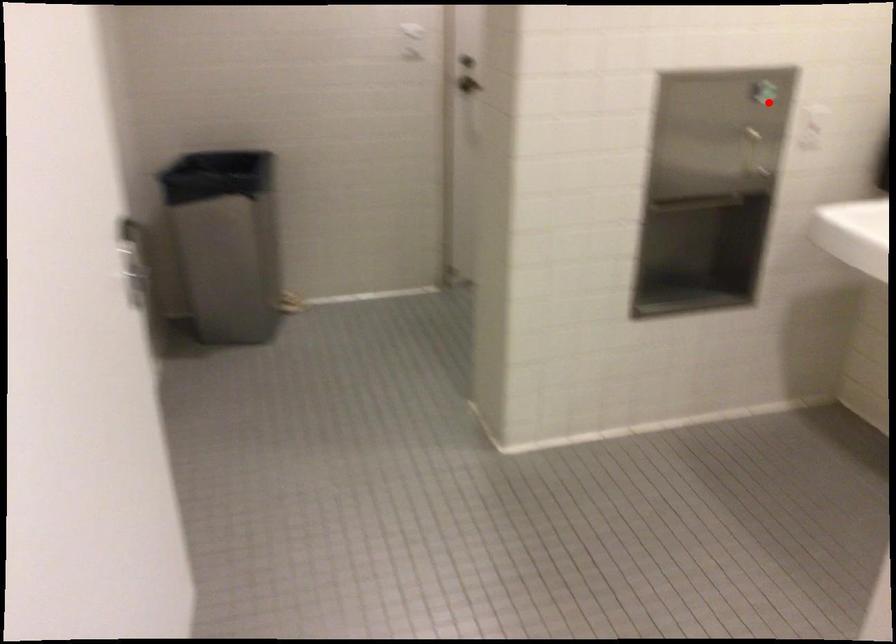
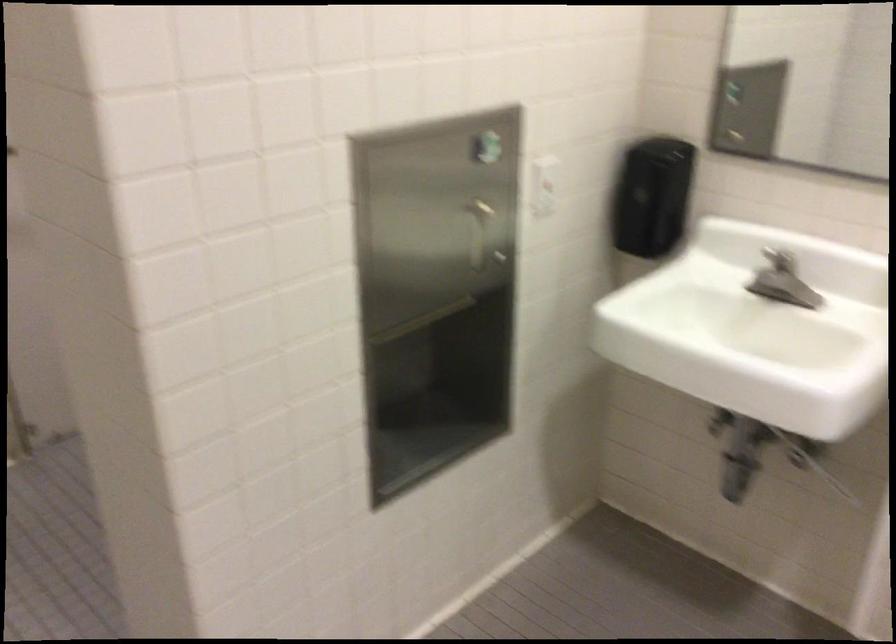
Question: I am providing you with two images of the same scene from different viewpoints. In image1, a red point is highlighted. Considering the same 3D point in image2, which of the following is correct?

Choices:
 (A) It is closer
 (B) It is farther

Answer: (A)